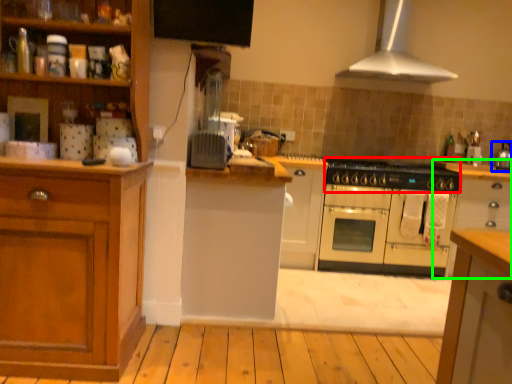
Question: Which object is positioned closest to gas stove (highlighted by a red box)? Select from kitchen appliance (highlighted by a blue box) and cabinetry (highlighted by a green box).

Choices:
 (A) kitchen appliance
 (B) cabinetry

Answer: (B)